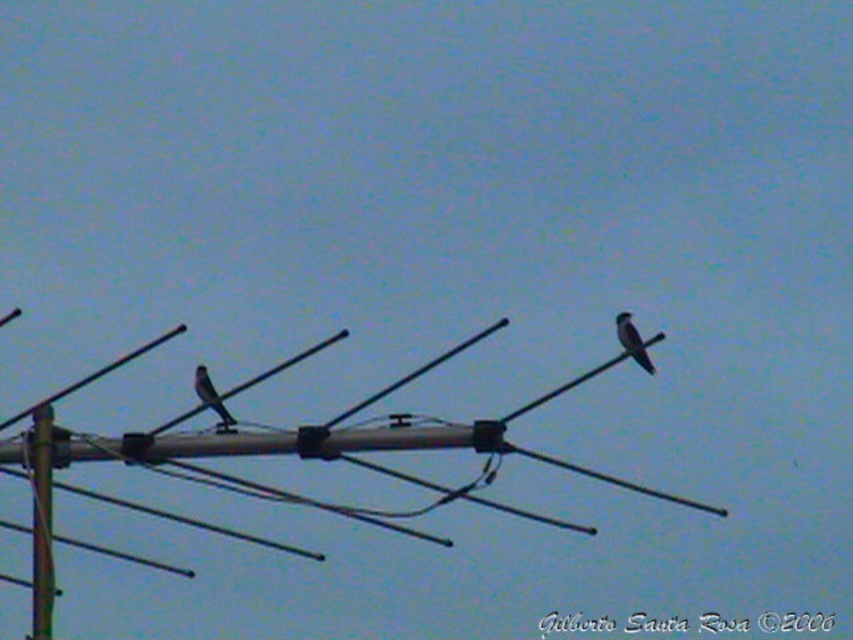
You are standing at a safe distance from the television antenna. You need to reach a point exactly at coordinate point (636, 332) on the antenna to fix a loose connection. Given that the distance from your current position to the camera is 100 feet, can you estimate how far you need to walk to reach the point?

The distance between point (636, 332) and the camera is 41.30 feet. Since you are currently 100 feet away from the camera, you need to walk approximately 58.7 feet towards the antenna to reach the point.

In the scene shown: You are a birdwatcher trying to locate the dark gray feathers at upper right on the antenna. According to the coordinates provided, where exactly would you look on the antenna?

The dark gray feathers at upper right are located at point (635, 340) on the antenna.

You are a birdwatcher trying to identify two birds on a TV antenna. You see a dark gray feathers at upper right and a gray matte bird at left. Which bird has a larger size?

The dark gray feathers at upper right is bigger than the gray matte bird at left.